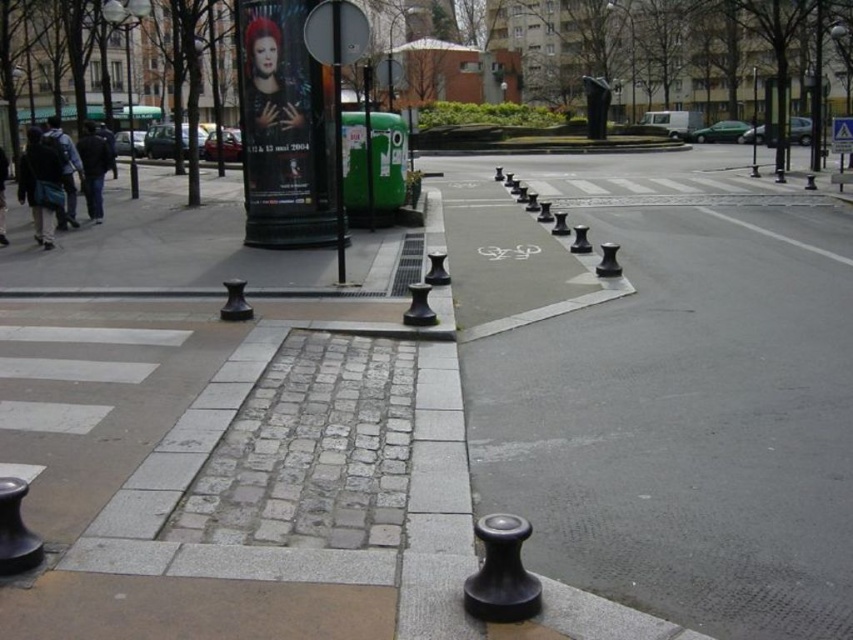
Question: Is black rubber bollards at center bigger than metallic pole at center?

Choices:
 (A) yes
 (B) no

Answer: (A)

Question: Which of the following is the closest to the observer?

Choices:
 (A) black rubber bollards at center
 (B) metallic pole at center

Answer: (A)

Question: Which point appears farthest from the camera in this image?

Choices:
 (A) (608, 529)
 (B) (334, 58)

Answer: (B)

Question: Is black rubber bollards at center closer to camera compared to metallic pole at center?

Choices:
 (A) yes
 (B) no

Answer: (A)

Question: Can you confirm if black rubber bollards at center is positioned below metallic pole at center?

Choices:
 (A) no
 (B) yes

Answer: (B)

Question: Which point appears farthest from the camera in this image?

Choices:
 (A) (497, 429)
 (B) (339, 195)

Answer: (B)